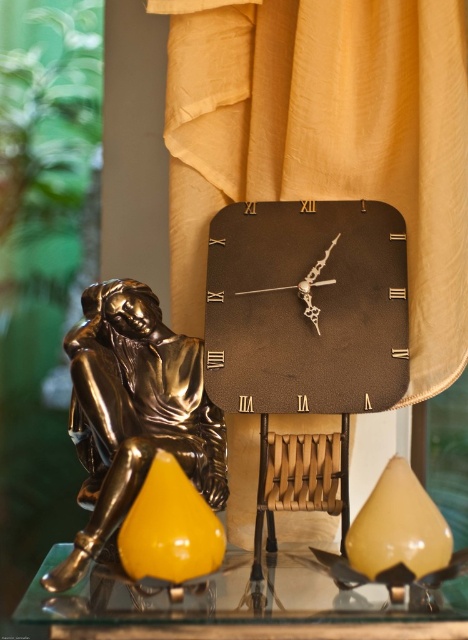
You are standing in front of the decorative arrangement and want to know which of the two points, point (165, 330) or point (235, 564), is closer to you. Based on the scene description, can you determine which point is nearer?

Point (165, 330) is further to the camera than point (235, 564), so the point closer to you is point (235, 564).

You are standing in front of the decorative arrangement and want to place a small vase exactly between the bronze sculpture and the black leather clock at center. Can you determine the coordinates where you should place the vase?

The black leather clock at center is located at coordinates point (307, 307). Since the bronze sculpture is not mentioned in the objects description, we cannot determine its exact coordinates. Therefore, it is not possible to calculate the midpoint between them.